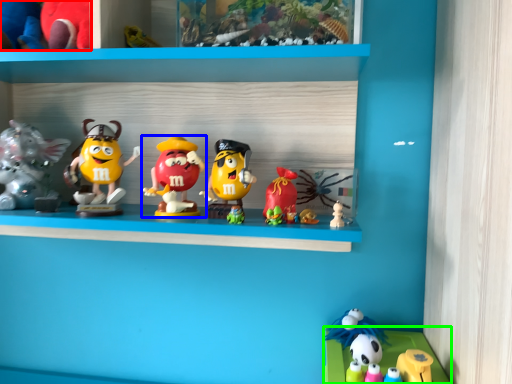
Question: Considering the real-world distances, which object is farthest from toy (highlighted by a red box)? toy (highlighted by a blue box) or shelf (highlighted by a green box)?

Choices:
 (A) toy
 (B) shelf

Answer: (B)